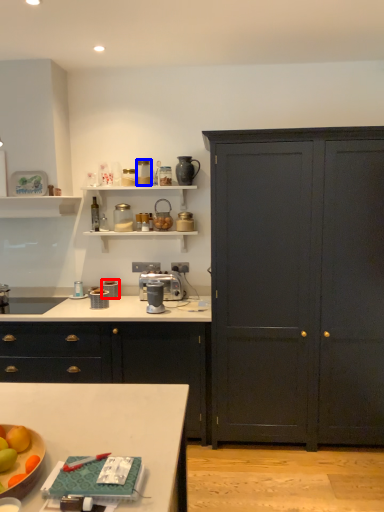
Question: Which of the following is the farthest to the observer, appliance (highlighted by a red box) or appliance (highlighted by a blue box)?

Choices:
 (A) appliance
 (B) appliance

Answer: (A)